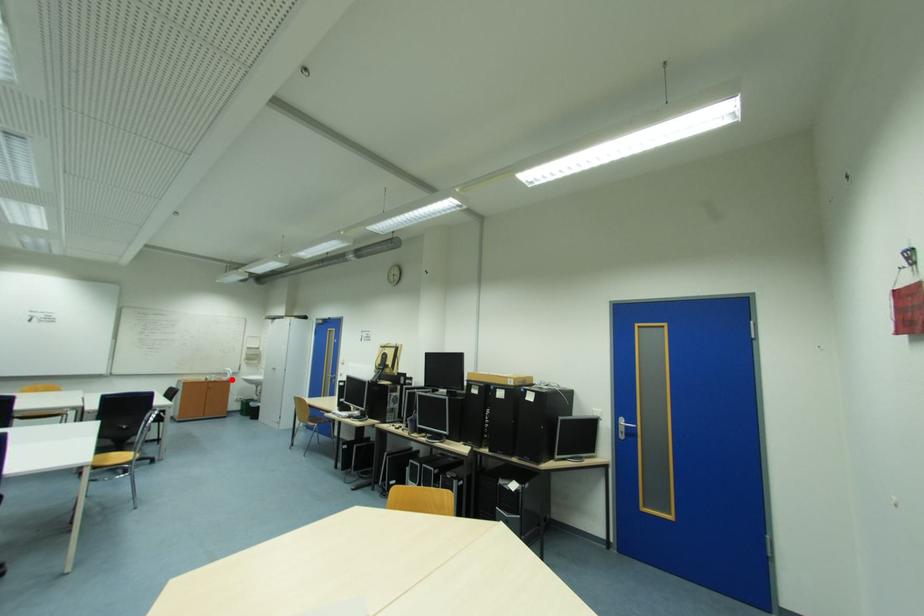
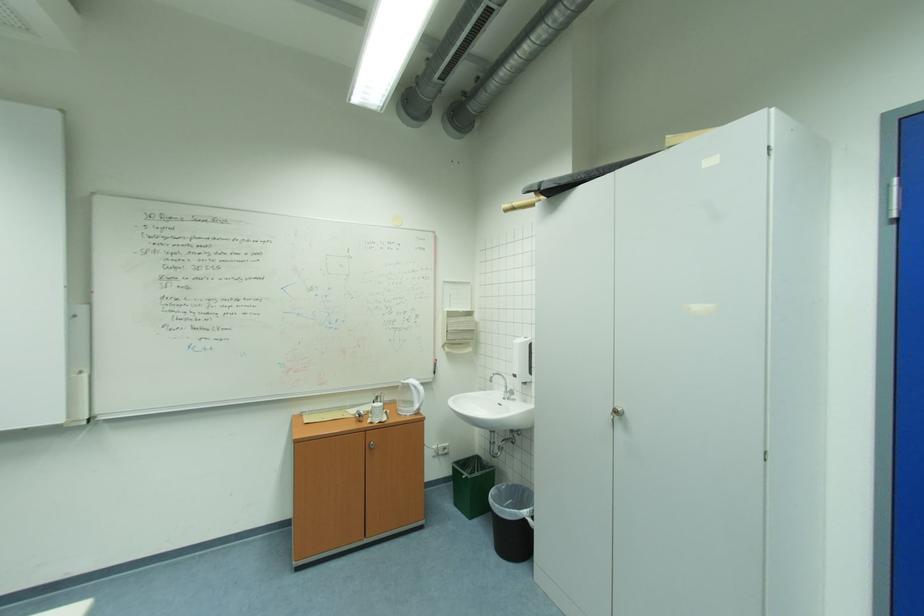
In the second image, find the point that corresponds to the highlighted location in the first image.

(415, 411)